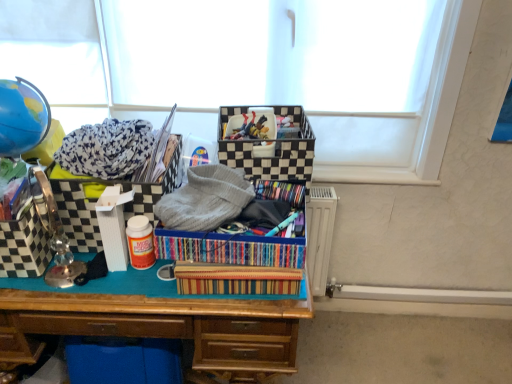
Locate an element on the screen. This screenshot has width=512, height=384. free space above multicolored striped fabric at center (from a real-world perspective) is located at coordinates (241, 208).